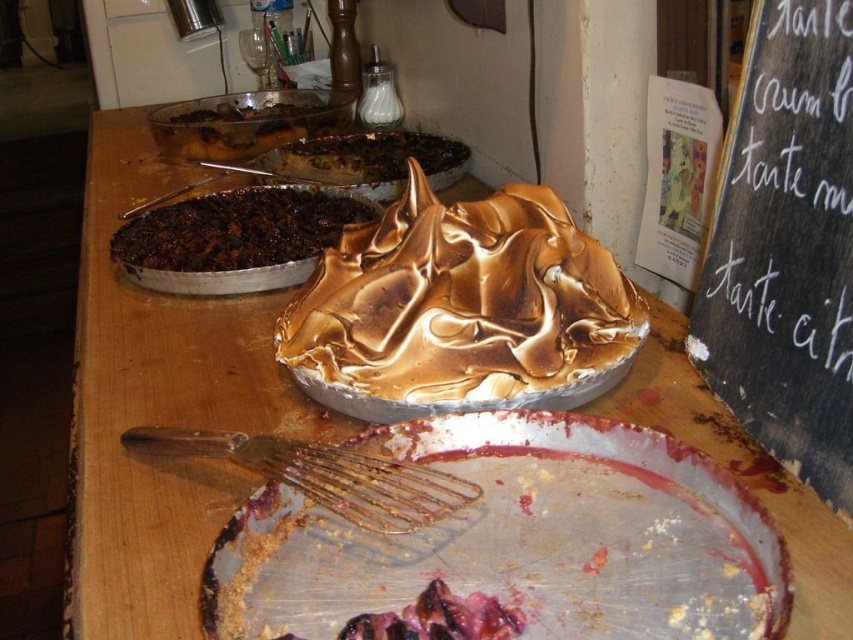
You are a chef evaluating the baked goods on the wooden table. Which item is shorter between the dark brown crumbly pie at upper left and the burnt chocolate cake at center?

The dark brown crumbly pie at upper left is shorter than the burnt chocolate cake at center.

You are a chef holding a 20 inch long rolling pin. You want to place it on the table near the gold metallic whisk at center without moving the whisk. Is there enough space?

The gold metallic whisk at center is 21.54 inches from the camera, so there is enough space to place the 20 inch rolling pin near it without moving the whisk.

You are a baker who needs to place both the dark brown crumbly pie at upper left and the burnt chocolate cake at center onto a shelf that can only hold items narrower than 30 cm. Which item might not fit?

The burnt chocolate cake at center might not fit because its width is greater than the dark brown crumbly pie at upper left, which is under 30 cm.